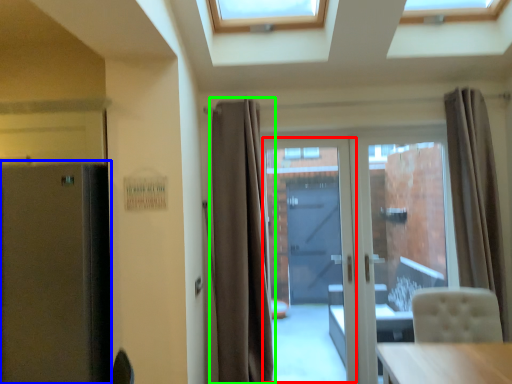
Question: Estimate the real-world distances between objects in this image. Which object is farther from garage door (highlighted by a red box), fridge (highlighted by a blue box) or curtain (highlighted by a green box)?

Choices:
 (A) fridge
 (B) curtain

Answer: (A)